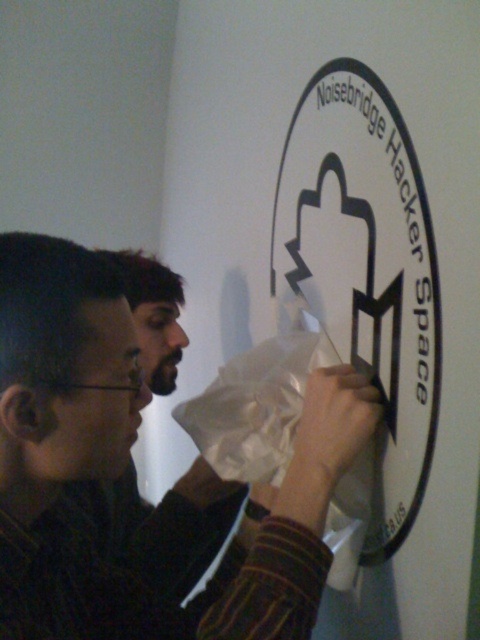
You are organizing a community event and need to place a 1.2 meter tall banner. The banner must be placed below the white matte sign at upper center but above the white matte paper bag at center. Is this possible?

The white matte sign at upper center is taller than the white matte paper bag at center. Since the banner needs to be placed below the sign and above the bag, the vertical space between them must be at least 1.2 meters. However, without knowing the exact distance between them, we cannot confirm if there is enough space. Please measure the available space before deciding.

You are a delivery person who just arrived at Noisebridge Hacker Space. You need to place a small package on the white matte paper bag at center without touching the white matte sign at upper center. Is there enough space between them to do this?

The white matte sign at upper center and white matte paper bag at center are 4.95 inches apart from each other. Since the package is small, there is sufficient space between them to place it on the white matte paper bag at center without touching the white matte sign at upper center.